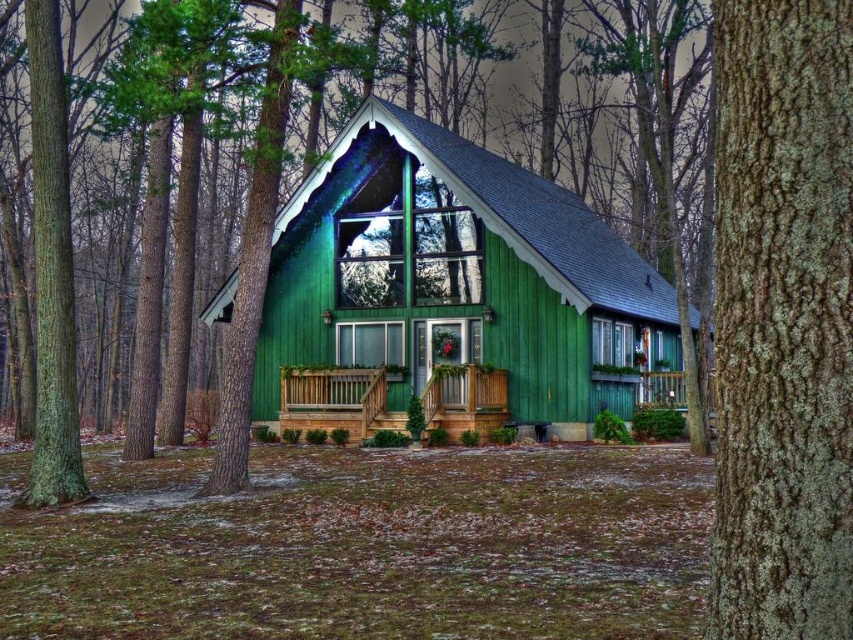
You are standing at a point 31.09 meters away from the camera. If you walk directly towards the camera, will you end up near the point labeled as point (x=438, y=131)?

Yes, because the distance between point (x=438, y=131) and the camera is 31.09 meters. If you walk directly towards the camera from your current position, you will reach the point labeled point (x=438, y=131).

You are standing on the wooden porch at center and want to see the top of the green rough bark tree at center. Is the top of the tree visible from your current position?

The green rough bark tree at center has a greater height compared to wooden porch at center, so the top of the tree is visible from the wooden porch at center.